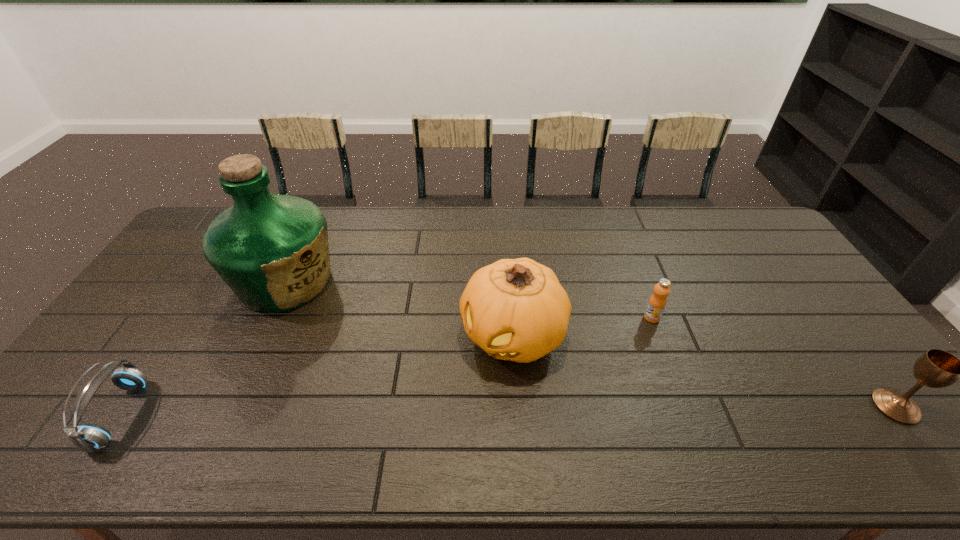
Locate an element on the screen. free space that satisfies the following two spatial constraints: 1. on the front side of the rightmost object; 2. on the left side of the liquor is located at coordinates (228, 406).